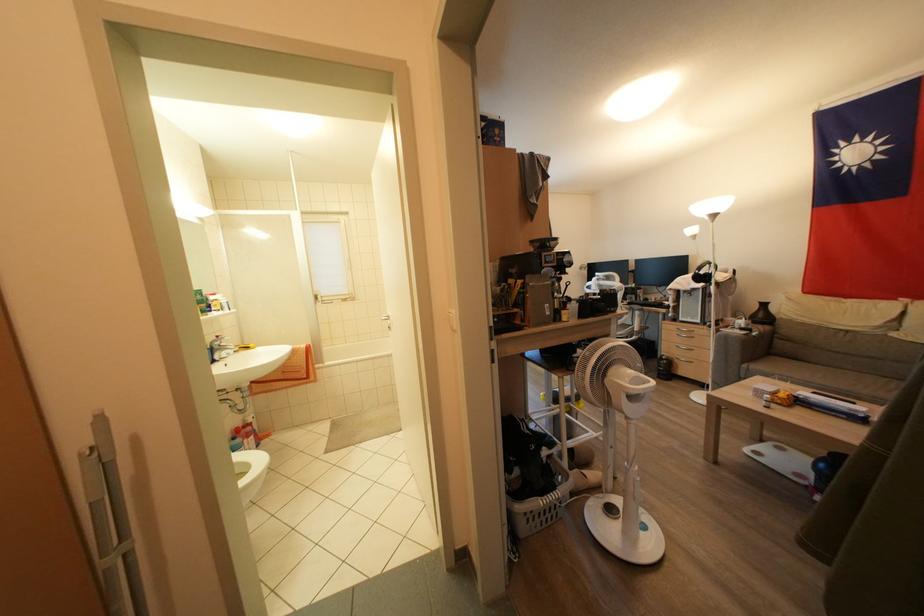
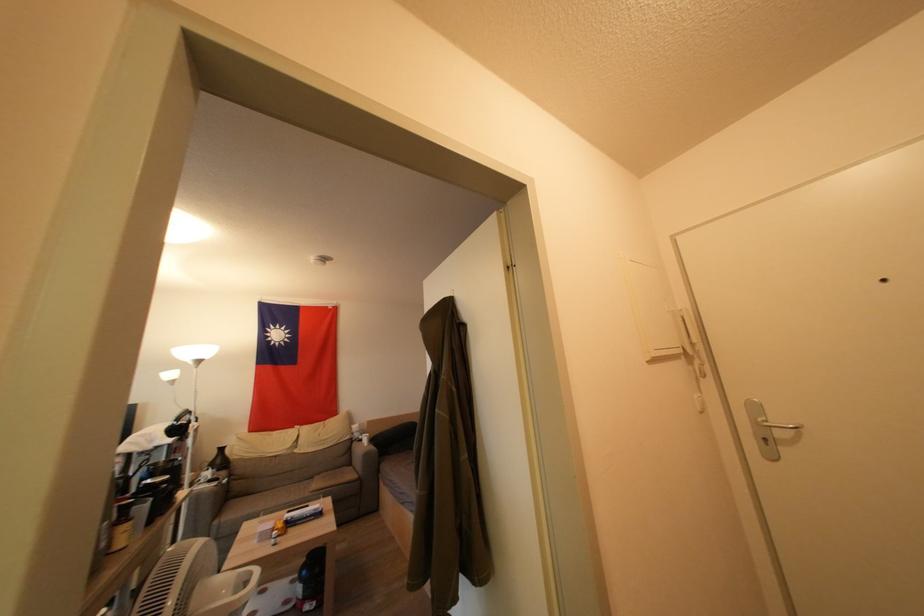
First-person continuous shooting, in which direction is the camera rotating?

The camera rotated toward right-up.